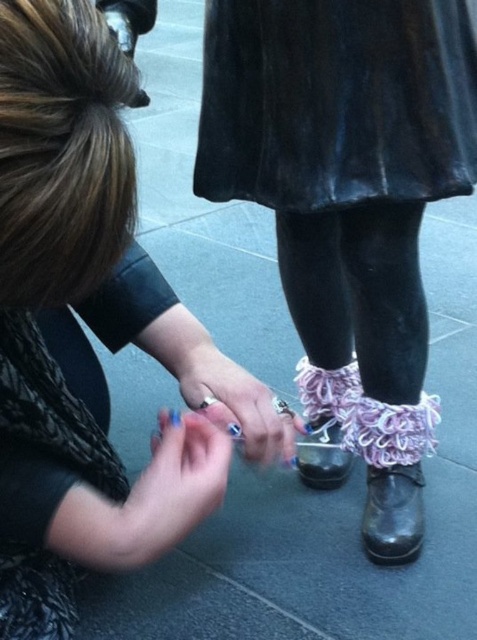
You are a photographer setting up a shoot. You need to ensure that the velvet black dress at upper center and the blue painted nails at center are visible in the frame. Given their distance apart, what is the minimum focal length you should use if your camera sensor has a diagonal of 24mm and the subjects are 3 meters away?

The velvet black dress at upper center and blue painted nails at center are 44.87 centimeters apart. To capture both in frame, the minimum focal length would be calculated using the formula focal length < sensor diagonal mm x distance to subject meters x 1000mm subject separation. Plugging in the numbers, focal length < 24mm x 3m x 1000mm 44.87cm. This results in a focal length less than approximately 162mm. Therefore, a focal length shorter than 162mm would ensure both elements are in frame.

You are trying to determine if the pink lace socks at lower right can fit into the black leather boot at lower right. Based on their widths, can the socks fit inside the boot?

The pink lace socks at lower right might be wider than the black leather boot at lower right, so there is a possibility that the socks may not fit inside the boot due to their width.